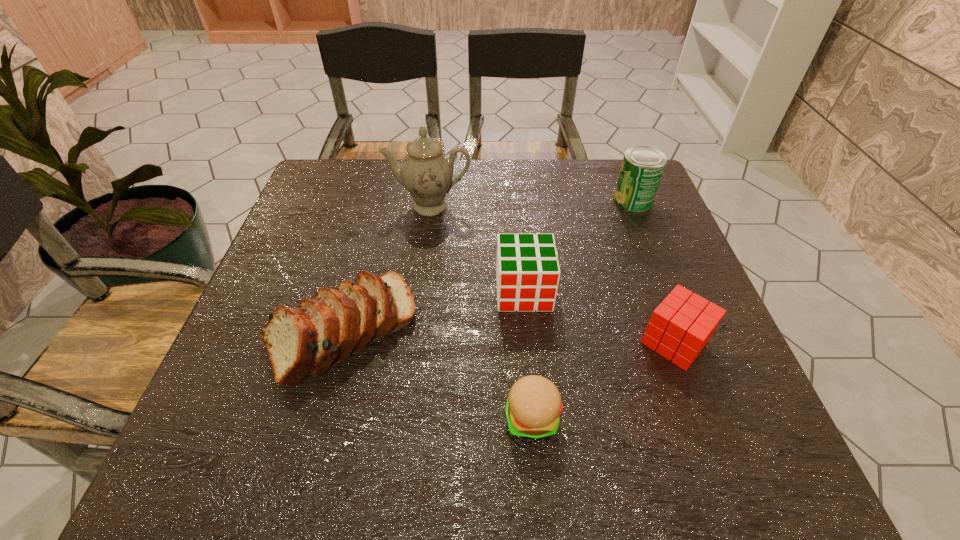
Image resolution: width=960 pixels, height=540 pixels. Find the location of `chinaware`. chinaware is located at coordinates (426, 171).

Identify the location of can. (642, 167).

This screenshot has height=540, width=960. Find the location of `the left cube`. the left cube is located at coordinates (527, 272).

Where is `the taller cube`? Image resolution: width=960 pixels, height=540 pixels. the taller cube is located at coordinates (527, 272).

Image resolution: width=960 pixels, height=540 pixels. Find the location of `bread`. bread is located at coordinates point(302,343).

Find the location of a particular element. The height and width of the screenshot is (540, 960). the shorter cube is located at coordinates (680, 327).

This screenshot has width=960, height=540. In order to click on the nearer cube in this screenshot , I will do `click(680, 327)`.

I want to click on the shortest object, so (534, 404).

In order to click on hamburger in this screenshot , I will do `click(534, 404)`.

You are a GUI agent. You are given a task and a screenshot of the screen. Output one action in this format:
    pyautogui.click(x=<x>, y=<y>)
    Task: Click on the vacant space located on the spout of the tallest object
    
    Given the screenshot: What is the action you would take?
    pyautogui.click(x=425, y=242)